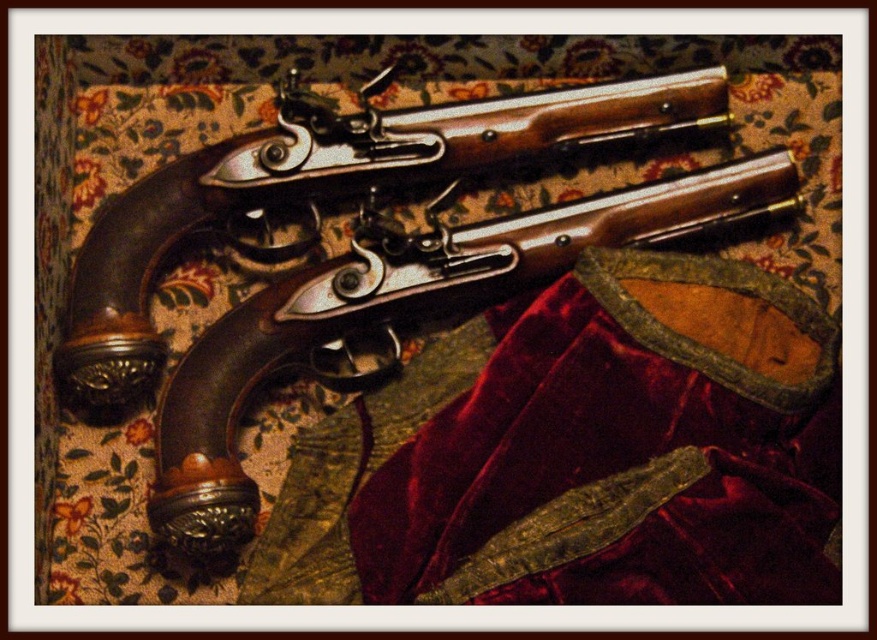
Can you confirm if polished wood shotgun at center is bigger than brown polished wood shotgun at center?

Indeed, polished wood shotgun at center has a larger size compared to brown polished wood shotgun at center.

Is point (75, 269) closer to viewer compared to point (526, 269)?

That is True.

Does point (87, 273) lie in front of point (605, 204)?

That is True.

Find the location of a particular element. Image resolution: width=877 pixels, height=640 pixels. polished wood shotgun at center is located at coordinates point(330,188).